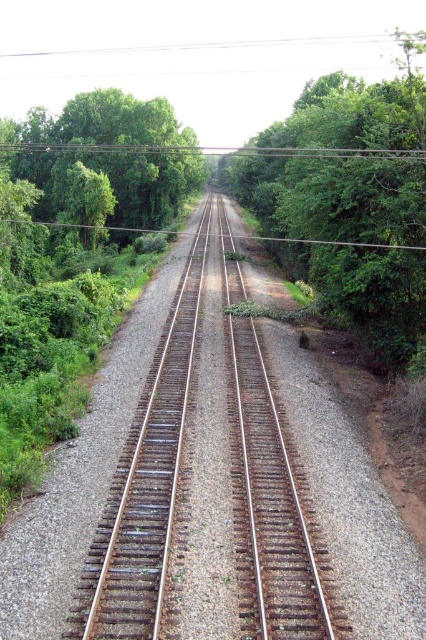
Does point (374, 113) lie behind point (63, 152)?

No.

Find the location of a particular element. The image size is (426, 640). green leafy tree at right is located at coordinates (342, 161).

Is rusty metal tracks at center smaller than green leafy tree at left?

Yes, rusty metal tracks at center is smaller than green leafy tree at left.

What do you see at coordinates (209, 484) in the screenshot?
I see `rusty metal tracks at center` at bounding box center [209, 484].

Is point (267, 445) positioned before point (60, 211)?

Yes, it is in front of point (60, 211).

I want to click on rusty metal tracks at center, so click(x=209, y=484).

Can you confirm if rusty metal tracks at center is shorter than green leafy tree at right?

Yes.

Does point (98, 627) come closer to viewer compared to point (317, 102)?

Yes, it is in front of point (317, 102).

The image size is (426, 640). Identify the location of rusty metal tracks at center. (209, 484).